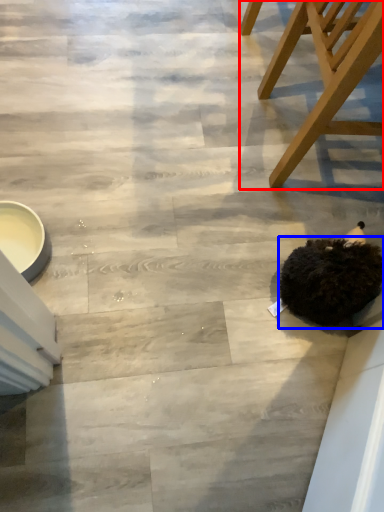
Question: Which of the following is the closest to the observer, chair (highlighted by a red box) or animal (highlighted by a blue box)?

Choices:
 (A) chair
 (B) animal

Answer: (A)